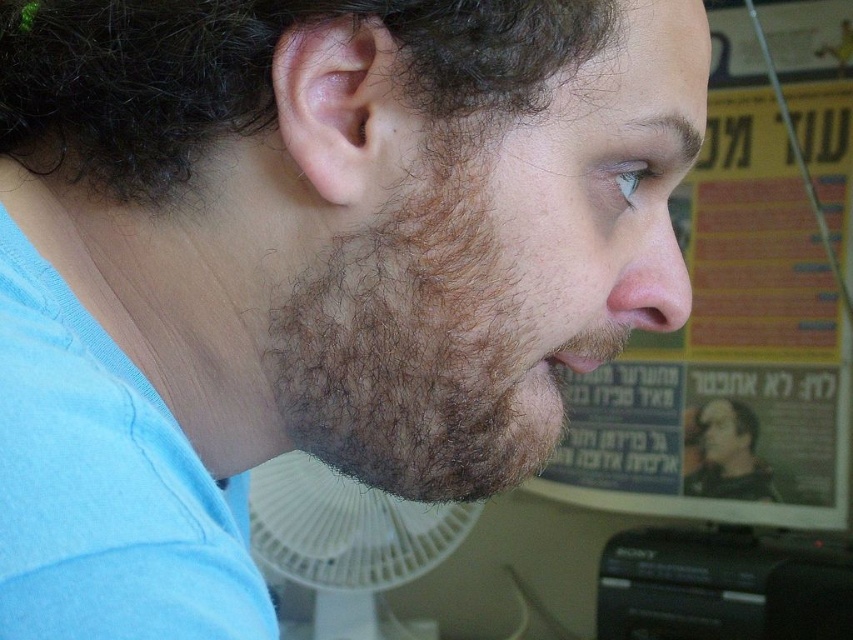
Question: Considering the real-world distances, which object is farthest from the pink flesh-colored ear at center?

Choices:
 (A) dark curly hair at upper left
 (B) brown fuzzy beard at lower left
 (C) white plastic fan at lower center

Answer: (C)

Question: Considering the relative positions of yellow paper at upper right and dark curly hair at upper left in the image provided, where is yellow paper at upper right located with respect to dark curly hair at upper left?

Choices:
 (A) below
 (B) above

Answer: (A)

Question: Where is dark curly hair at upper left located in relation to white plastic fan at lower center in the image?

Choices:
 (A) below
 (B) above

Answer: (B)

Question: Is brown fuzzy beard at lower left wider than white plastic fan at lower center?

Choices:
 (A) yes
 (B) no

Answer: (B)

Question: Which point is closer to the camera?

Choices:
 (A) (755, 456)
 (B) (57, 92)

Answer: (B)

Question: Which object is farther from the camera taking this photo?

Choices:
 (A) yellow paper at upper right
 (B) brown fuzzy beard at lower left
 (C) dark curly hair at upper left

Answer: (A)